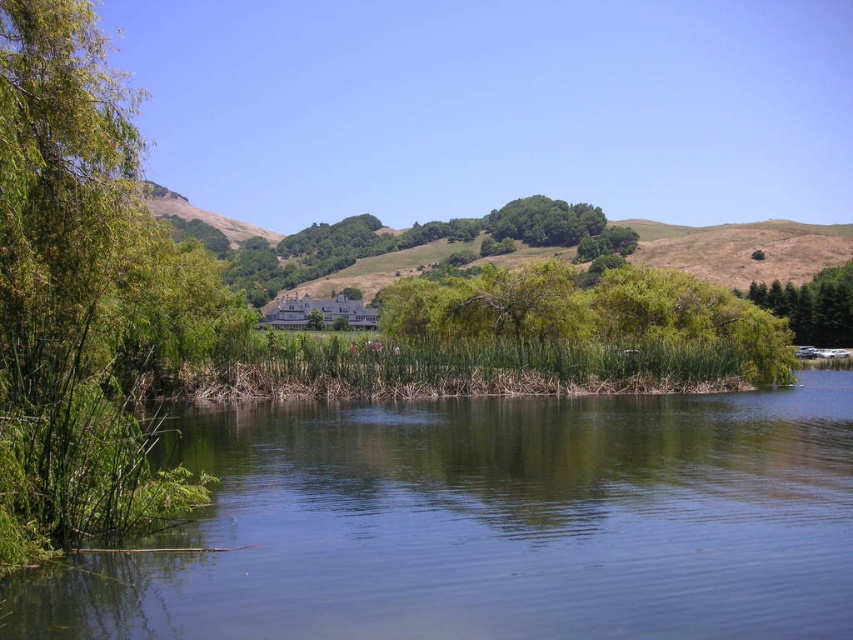
From the picture: You are standing at the center of the image and want to reach the green leafy tree at left. Which direction should you move in to get there?

The green leafy tree at left is located at point (x=86, y=296), so you should move to the left and slightly forward to reach it.

You are standing at the edge of the water in the foreground and want to reach the green leafy bush at center. Which direction should you head towards?

The green leafy bush at center is located at coordinates point (587, 312), so you should head towards the middle of the image to reach it.

Based on the photo, you are an environmental scientist observing this landscape. You notice the green leafy tree at left and the green leafy bush at center. Which of these two plants is closer to your viewpoint?

The green leafy tree at left is closer to your viewpoint because it is positioned in front of the green leafy bush at center.